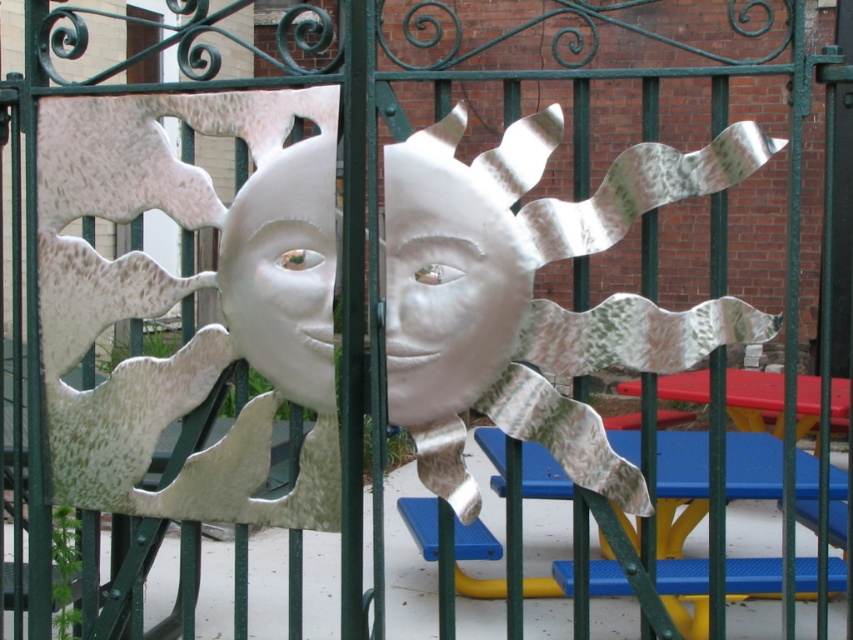
You are a painter standing in front of the decorative metal gate. You want to paint the smaller sun first. Which one should you choose between the white metallic sun at center and the metallic silver sun at center?

The metallic silver sun at center is the smaller one, so you should choose the metallic silver sun at center to paint first.

You are a painter who wants to paint both the metallic silver sun at center and the metallic green door at center. Which object requires a larger canvas to capture its full size?

The metallic silver sun at center is bigger than the metallic green door at center, so it requires a larger canvas to capture its full size.